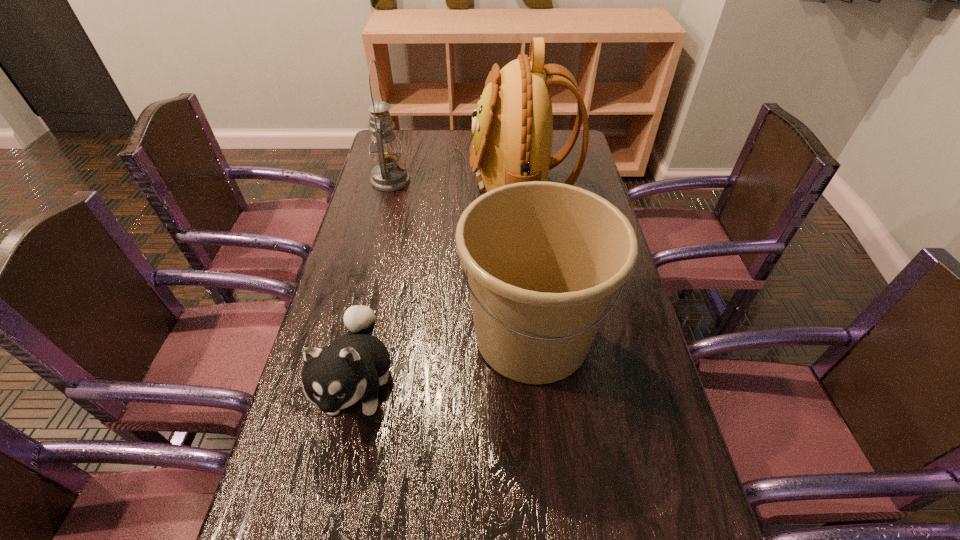
Identify the location of free space that satisfies the following two spatial constraints: 1. on the front-facing side of the tallest object; 2. at the face of the shortest object. 544,384.

The width and height of the screenshot is (960, 540). In order to click on free point that satisfies the following two spatial constraints: 1. on the front-facing side of the tallest object; 2. on the front side of the second shortest object in this screenshot , I will do point(539,336).